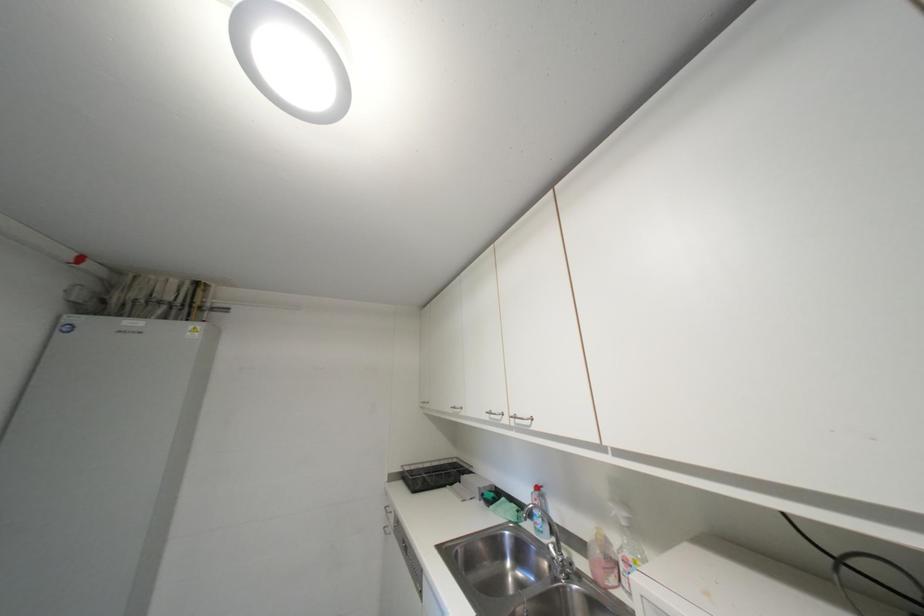
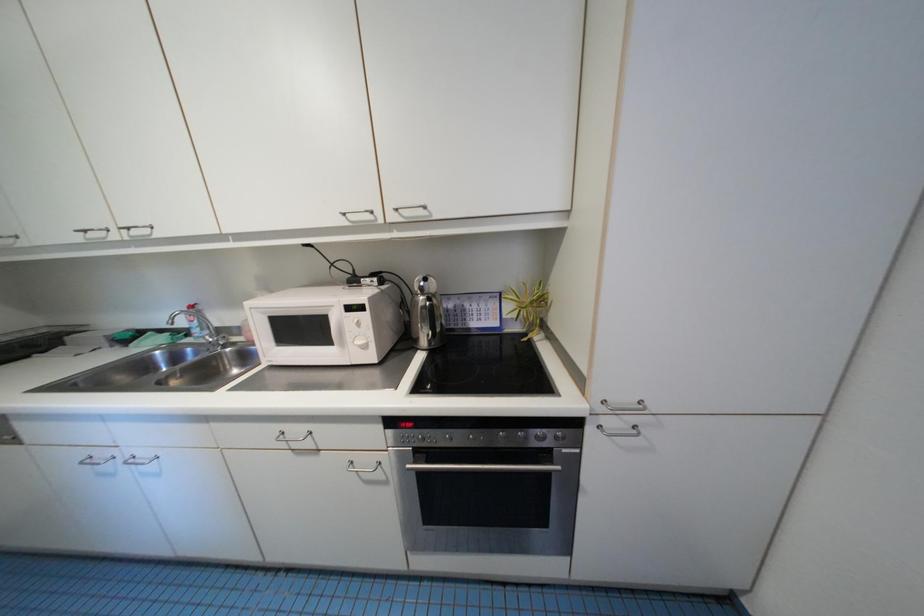
Based on the continuous images, in which direction is the camera rotating?

The rotation direction of the camera is right-down.